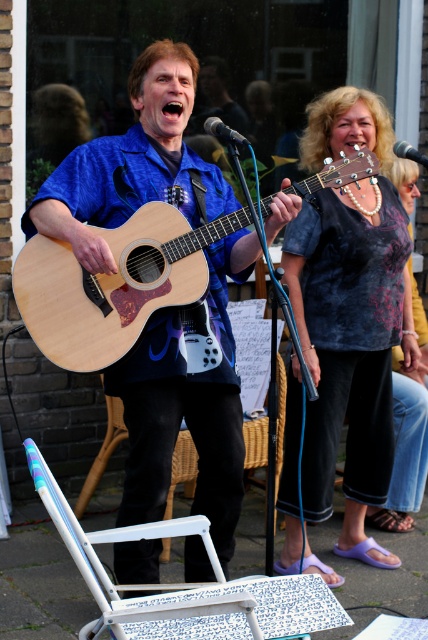
Question: Can you confirm if pearl necklace at upper center is positioned to the left of metallic silver microphone at center?

Choices:
 (A) no
 (B) yes

Answer: (B)

Question: Is natural wood acoustic guitar at center thinner than metallic silver microphone at center?

Choices:
 (A) yes
 (B) no

Answer: (B)

Question: Which point is closer to the camera?

Choices:
 (A) click(190, 307)
 (B) click(368, 284)
 (C) click(58, 492)

Answer: (C)

Question: Does pearl necklace at upper center lie behind white painted wood folding chair at lower left?

Choices:
 (A) yes
 (B) no

Answer: (A)

Question: Among these points, which one is farthest from the camera?

Choices:
 (A) [122, 205]
 (B) [163, 525]

Answer: (A)

Question: Among these objects, which one is nearest to the camera?

Choices:
 (A) metallic silver microphone at center
 (B) white painted wood folding chair at lower left

Answer: (B)